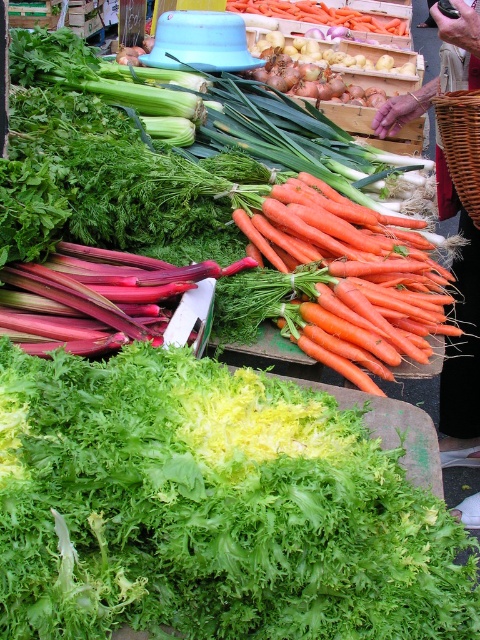
You are a chef preparing a vegetable platter and need to choose between the orange smooth carrots at center and the orange matte carrots at center based on their height. Which carrots should you pick if you want the taller ones?

The orange smooth carrots at center is much taller than the orange matte carrots at center, so you should pick the orange smooth carrots at center.

You are setting up a vegetable display at a market stall. You have a green leafy lettuce at center and orange matte carrots at center. Which vegetable has a smaller width?

The green leafy lettuce at center has a smaller width than the orange matte carrots at center.

You are setting up a vegetable display at the market. You have a green leafy lettuce at center and an orange smooth carrots at center. Which vegetable should you place in a spot that requires less space due to its smaller size?

The green leafy lettuce at center is smaller than the orange smooth carrots at center, so it should be placed in the spot that requires less space.